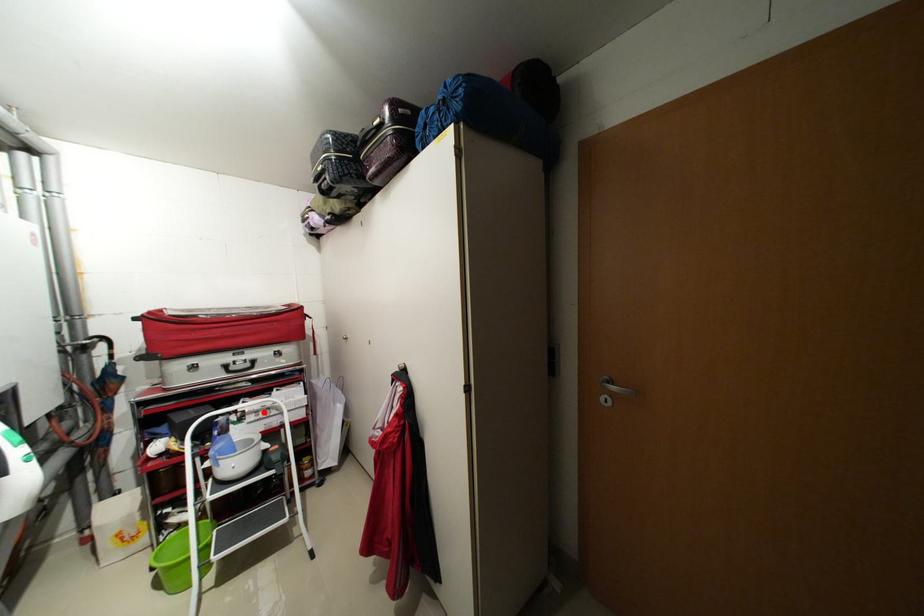
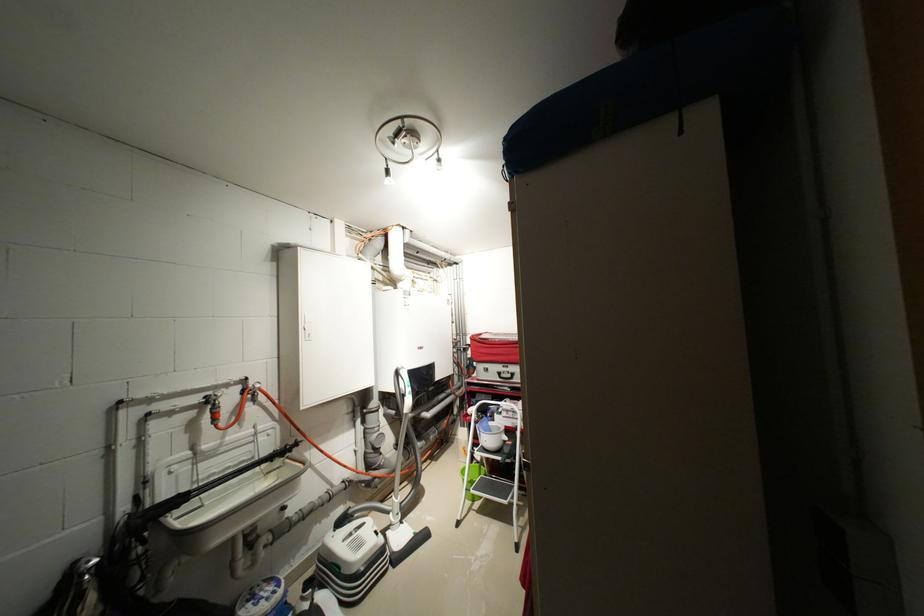
The point at the highlighted location is marked in the first image. Where is the corresponding point in the second image?

(515, 411)